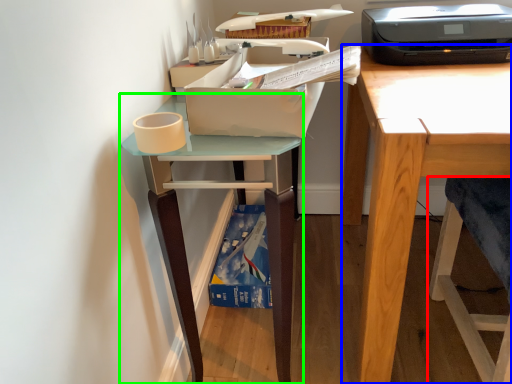
Question: Estimate the real-world distances between objects in this image. Which object is farther from folding chair (highlighted by a red box), desk (highlighted by a blue box) or table (highlighted by a green box)?

Choices:
 (A) desk
 (B) table

Answer: (B)